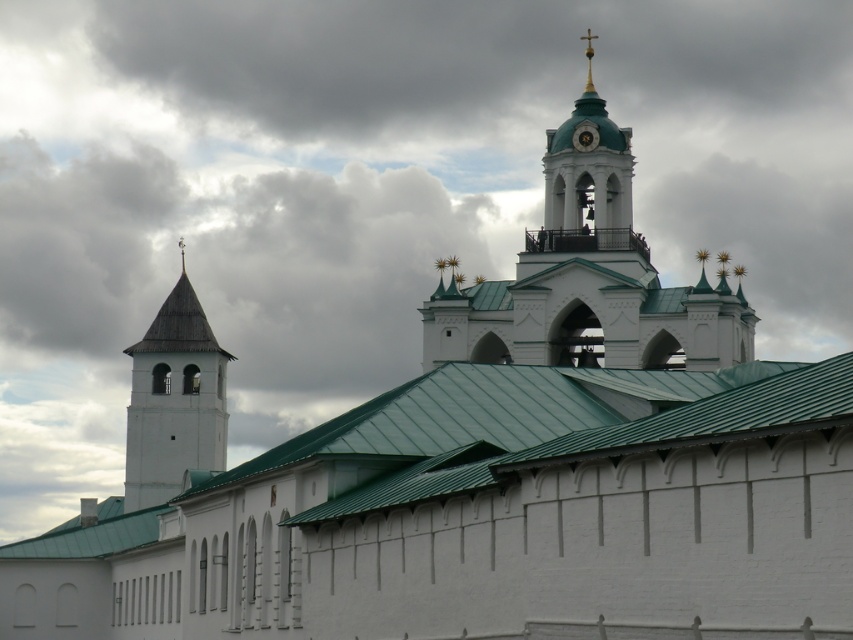
You are an architect inspecting the historic building complex. You need to determine which structure is taller between the white stone tower at left and the green matte bell tower at upper center. Based on the scene, which one is taller?

The white stone tower at left is taller than the green matte bell tower at upper center according to the description provided.

You are an architect examining the historic building complex. You notice the white stone tower at left and the gold metallic clock at upper center. Which of these two objects is located to the left of the other?

The white stone tower at left is positioned on the left side of the gold metallic clock at upper center.